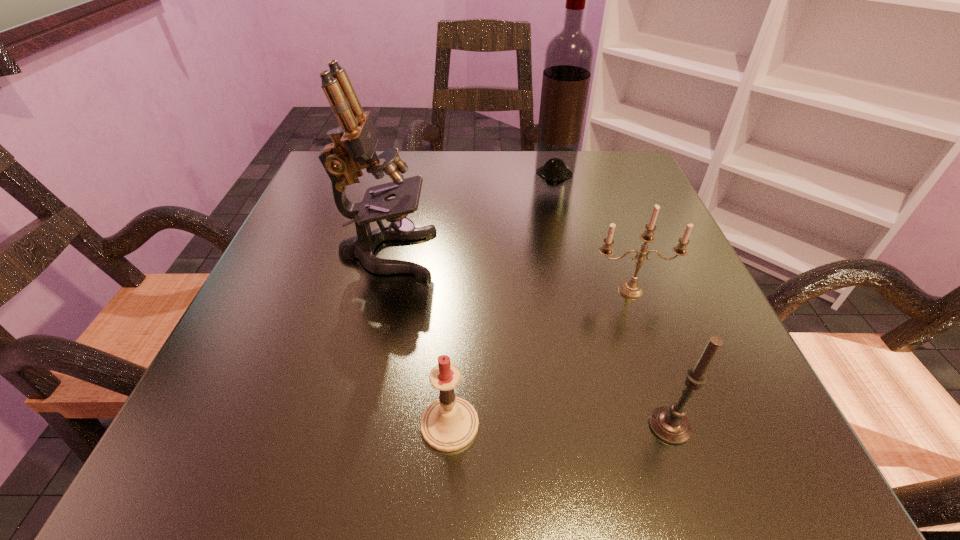
Image resolution: width=960 pixels, height=540 pixels. Identify the location of vacant region located on the left of the shortest object. (260, 424).

Where is `object that is positioned at the far edge`? This screenshot has height=540, width=960. object that is positioned at the far edge is located at coordinates (569, 55).

In order to click on object located at the left edge in this screenshot , I will do `click(354, 141)`.

The image size is (960, 540). In order to click on wine bottle that is at the right edge in this screenshot , I will do pos(569,55).

Where is `object that is at the far right corner`? object that is at the far right corner is located at coordinates (569, 55).

Locate an element on the screen. The height and width of the screenshot is (540, 960). object that is positioned at the near right corner is located at coordinates (669, 423).

Image resolution: width=960 pixels, height=540 pixels. Identify the location of vacant space at the far edge. pos(516,166).

Identify the location of blank space at the near edge of the desktop. pos(335,470).

I want to click on vacant point at the left edge, so click(246, 341).

Image resolution: width=960 pixels, height=540 pixels. I want to click on free point at the near left corner, so click(x=167, y=461).